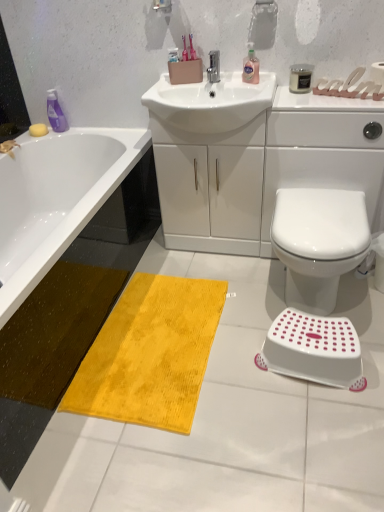
In order to click on blank space situated above yellow plush bath mat at center (from a real-world perspective) in this screenshot , I will do `click(161, 333)`.